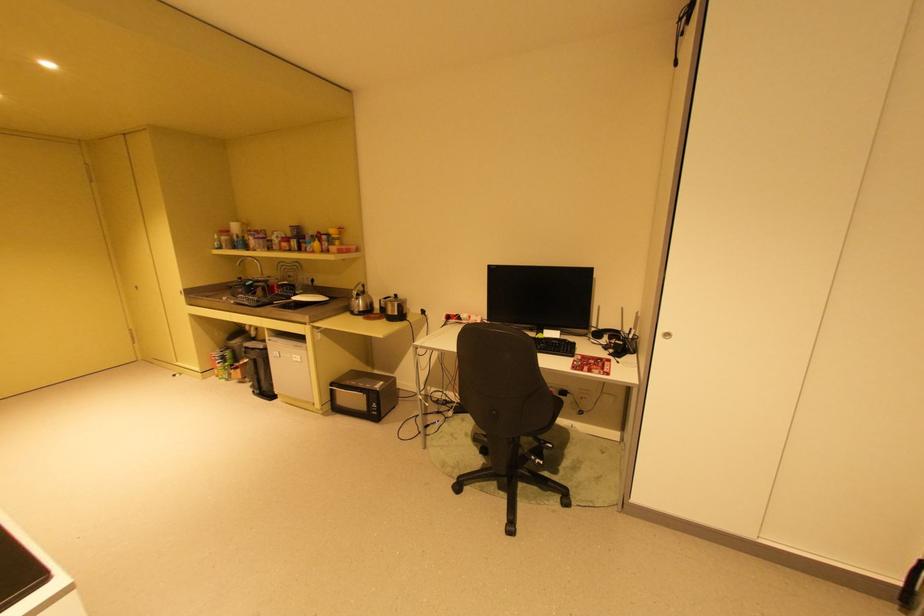
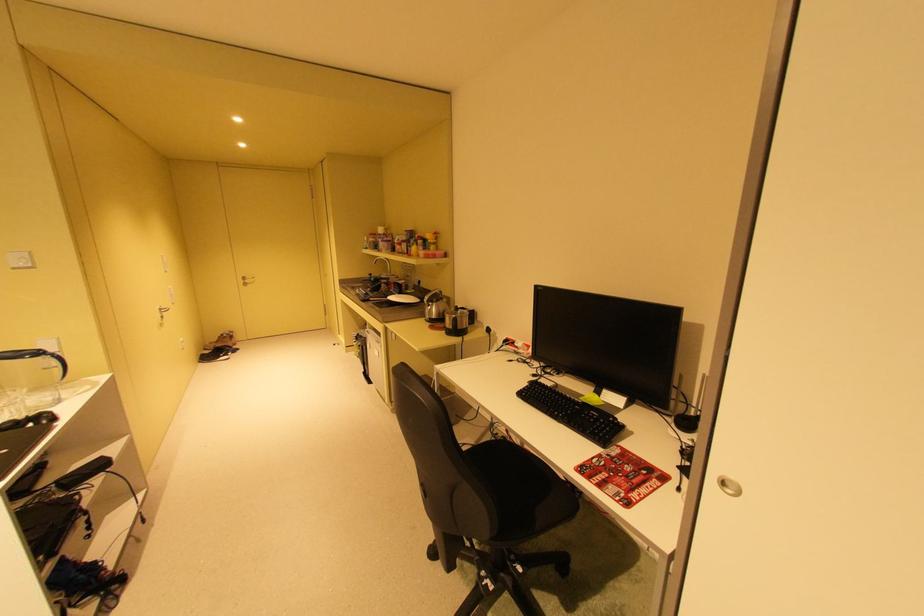
In the second image, find the point that corresponds to point (325, 233) in the first image.

(428, 237)